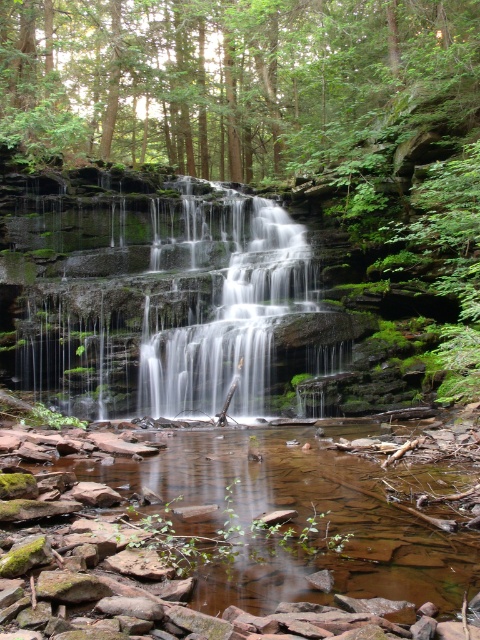
You are a hiker who wants to cross the brown rock stream at lower center. There is a green leafy tree at upper center nearby. Which direction should you look to see the tree while standing on the stream?

The brown rock stream at lower center is positioned under the green leafy tree at upper center, so you should look upward to see the green leafy tree at upper center while standing on the stream.

You are standing in the forest and want to cross the brown rock stream at lower center to reach the smooth gray rock waterfall at center. Is the stream between you and the waterfall?

Yes, the brown rock stream at lower center is between you and the smooth gray rock waterfall at center because it is closer to the viewer.

In the scene shown: You are a hiker planning to cross the brown rock stream at lower center and the smooth gray rock waterfall at center. Which path would require climbing higher?

The smooth gray rock waterfall at center requires climbing higher since it has a greater height than the brown rock stream at lower center.